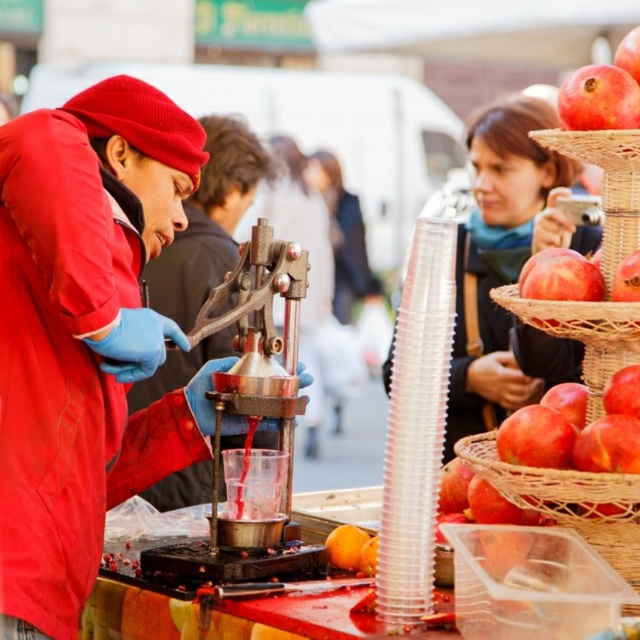
Question: Which point appears closest to the camera in this image?

Choices:
 (A) (120, 369)
 (B) (180, 324)
 (C) (628, 120)
 (D) (502, 172)

Answer: (A)

Question: Which point is closer to the camera?

Choices:
 (A) [x=628, y=358]
 (B) [x=20, y=275]
 (C) [x=460, y=378]
 (D) [x=157, y=282]

Answer: (B)

Question: Does matte black phone at upper right appear on the left side of pomegranate matte at right?

Choices:
 (A) no
 (B) yes

Answer: (A)

Question: Is matte red jacket at left further to camera compared to matte black phone at upper right?

Choices:
 (A) no
 (B) yes

Answer: (A)

Question: Can you confirm if matte black phone at upper right is positioned to the left of red woven basket at right?

Choices:
 (A) yes
 (B) no

Answer: (B)

Question: Which of the following is the farthest from the observer?

Choices:
 (A) pomegranate matte at right
 (B) matte red jacket at left

Answer: (A)